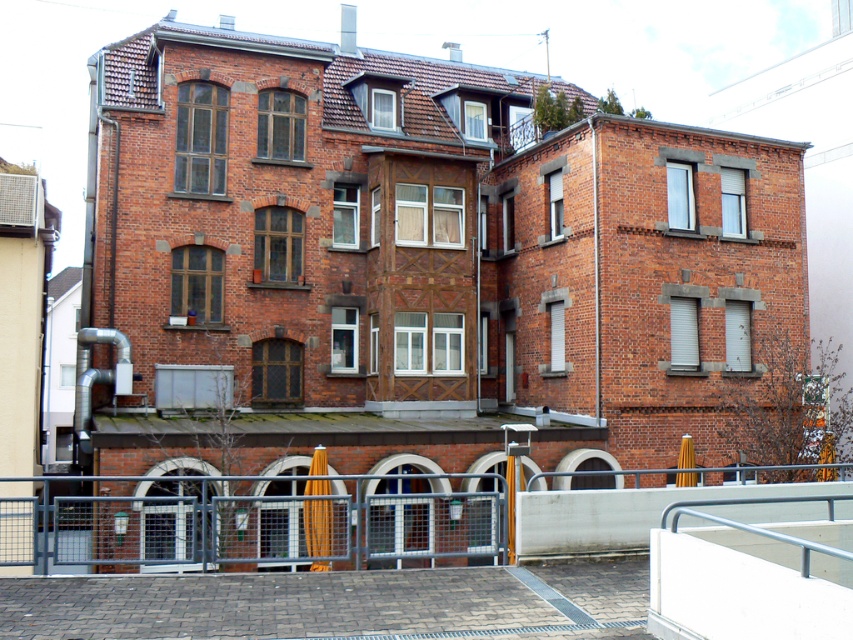
Based on the photo, is metal mesh fence at lower center positioned behind silver metallic rail at lower right?

Yes, metal mesh fence at lower center is behind silver metallic rail at lower right.

Is metal mesh fence at lower center to the left of silver metallic rail at lower right from the viewer's perspective?

Indeed, metal mesh fence at lower center is positioned on the left side of silver metallic rail at lower right.

Does point (148, 477) come in front of point (845, 497)?

No, it is not.

The height and width of the screenshot is (640, 853). Identify the location of metal mesh fence at lower center. (245, 522).